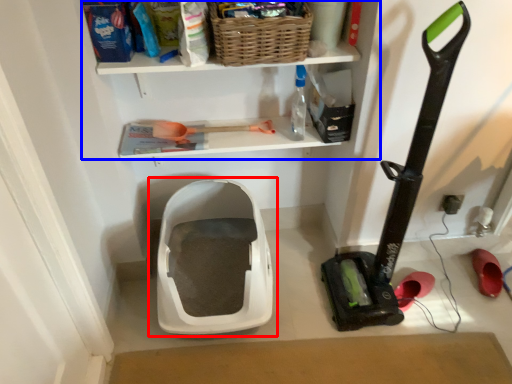
Question: Which point is closer to the camera, toilet (highlighted by a red box) or shelf (highlighted by a blue box)?

Choices:
 (A) toilet
 (B) shelf

Answer: (B)